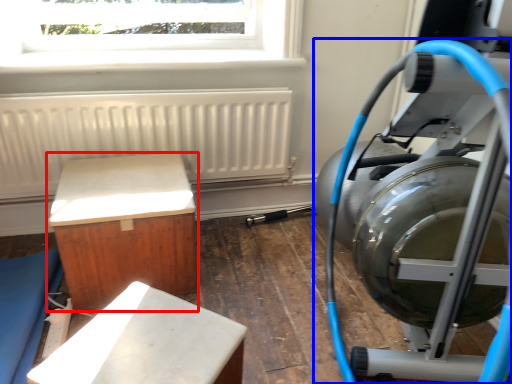
Question: Which of the following is the farthest to the observer, furniture (highlighted by a red box) or stationary bicycle (highlighted by a blue box)?

Choices:
 (A) furniture
 (B) stationary bicycle

Answer: (A)